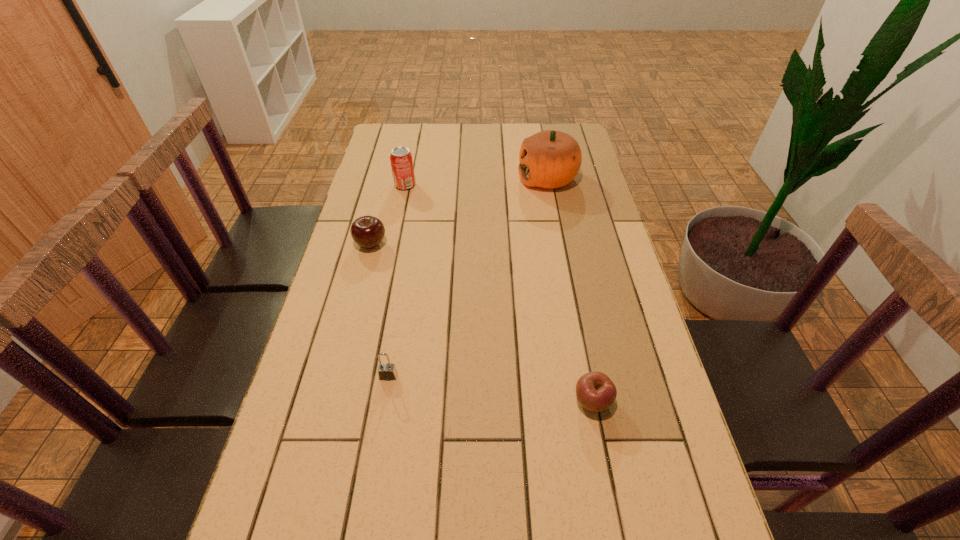
The image size is (960, 540). In order to click on vacant space located 0.070m on the right of the soda can in this screenshot , I will do `click(436, 185)`.

Find the location of a particular element. free region located 0.170m on the back of the left apple is located at coordinates (382, 201).

This screenshot has width=960, height=540. In order to click on free space located on the shackle of the fourth farthest object in this screenshot , I will do `click(377, 446)`.

I want to click on vacant point located on the side of the right apple with the unique marking, so click(618, 536).

Find the location of a particular element. Image resolution: width=960 pixels, height=540 pixels. soda can situated at the left edge is located at coordinates (401, 160).

The image size is (960, 540). What are the coordinates of `apple at the left edge` in the screenshot? It's located at (368, 232).

What are the coordinates of `pumpkin present at the right edge` in the screenshot? It's located at (549, 159).

What are the coordinates of `apple at the right edge` in the screenshot? It's located at (595, 391).

Identify the location of free spot at the left edge of the desktop. (350, 275).

This screenshot has width=960, height=540. What are the coordinates of `vacant region at the right edge of the desktop` in the screenshot? It's located at (560, 203).